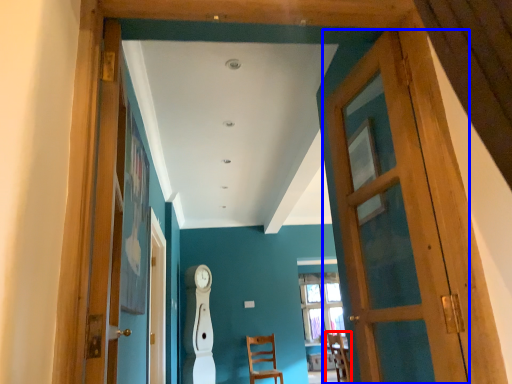
Question: Among these objects, which one is nearest to the camera, chair (highlighted by a red box) or door (highlighted by a blue box)?

Choices:
 (A) chair
 (B) door

Answer: (B)